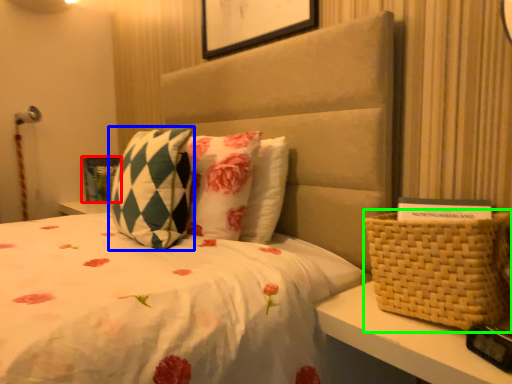
Question: Based on their relative distances, which object is nearer to picture frame (highlighted by a red box)? Choose from pillow (highlighted by a blue box) and basket (highlighted by a green box).

Choices:
 (A) pillow
 (B) basket

Answer: (A)